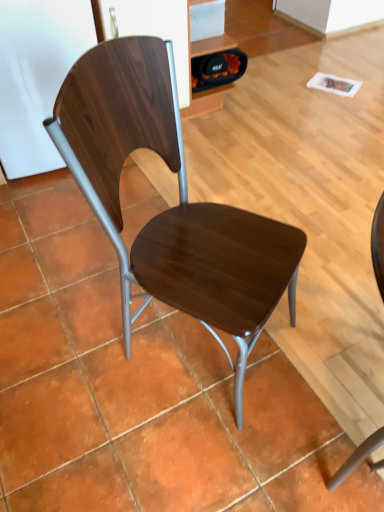
Locate an element on the screen. The width and height of the screenshot is (384, 512). vacant position to the left of shiny dark wood chair at center is located at coordinates (77, 354).